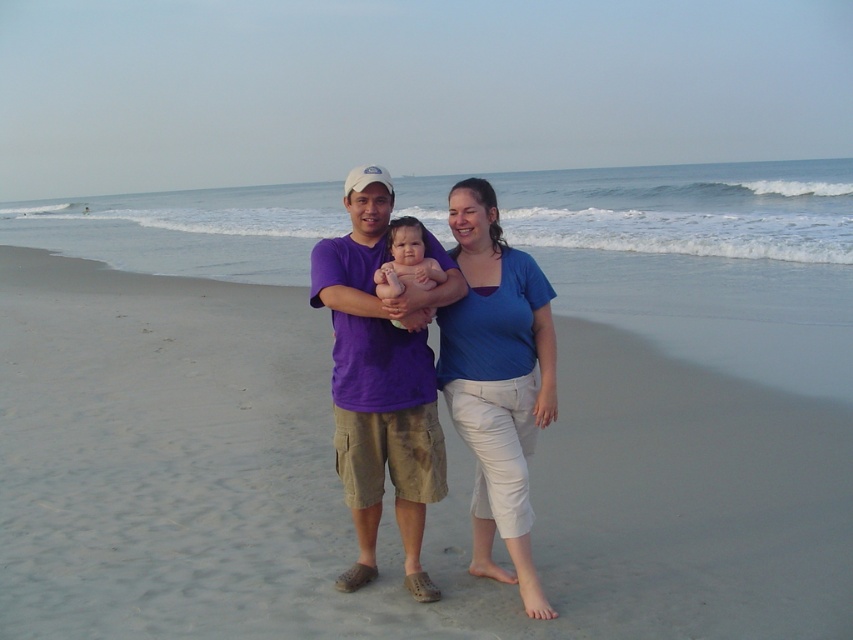
In the scene shown: Between purple cotton t-shirt at center and blue cotton shirt at center, which one appears on the right side from the viewer's perspective?

blue cotton shirt at center

Does purple cotton t-shirt at center have a lesser height compared to blue cotton shirt at center?

Correct, purple cotton t-shirt at center is not as tall as blue cotton shirt at center.

Who is more forward, (421, 520) or (549, 339)?

Point (549, 339) is more forward.

Where is `purple cotton t-shirt at center`? The image size is (853, 640). purple cotton t-shirt at center is located at coordinates (381, 380).

Looking at this image, does smooth sand at center come in front of purple cotton t-shirt at center?

Yes, it is.

Is point (737, 410) positioned after point (395, 388)?

Yes, it is behind point (395, 388).

You are a GUI agent. You are given a task and a screenshot of the screen. Output one action in this format:
    pyautogui.click(x=<x>, y=<y>)
    Task: Click on the smooth sand at center
    The width and height of the screenshot is (853, 640).
    Given the screenshot: What is the action you would take?
    pyautogui.click(x=387, y=492)

Does smooth sand at center have a greater width compared to soft pink skin at center?

Yes, smooth sand at center is wider than soft pink skin at center.

Is smooth sand at center to the left of soft pink skin at center from the viewer's perspective?

Yes, smooth sand at center is to the left of soft pink skin at center.

Where is `smooth sand at center`? smooth sand at center is located at coordinates (387, 492).

You are a GUI agent. You are given a task and a screenshot of the screen. Output one action in this format:
    pyautogui.click(x=<x>, y=<y>)
    Task: Click on the smooth sand at center
    This screenshot has width=853, height=640.
    Given the screenshot: What is the action you would take?
    pyautogui.click(x=387, y=492)